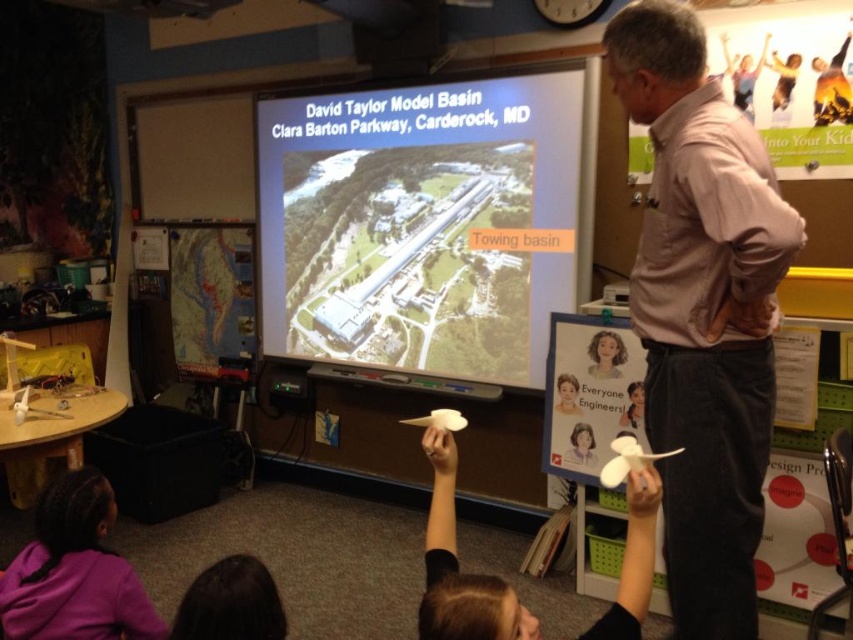
Question: Is white paper airplane at center wider than matte black projector at upper center?

Choices:
 (A) yes
 (B) no

Answer: (B)

Question: Estimate the real-world distances between objects in this image. Which object is closer to the matte black projector at upper center?

Choices:
 (A) white paper airplane at right
 (B) purple fabric at lower left

Answer: (B)

Question: Can you confirm if white paper airplane at right is positioned below matte black projector at upper center?

Choices:
 (A) no
 (B) yes

Answer: (B)

Question: Which object appears farthest from the camera in this image?

Choices:
 (A) matte black projector at upper center
 (B) white paper airplane at right
 (C) matte white projector screen at center

Answer: (A)

Question: Among these objects, which one is farthest from the camera?

Choices:
 (A) matte black projector at upper center
 (B) purple fabric at lower left
 (C) white paper airplane at center

Answer: (A)

Question: Can you confirm if matte white projector screen at center is smaller than matte black projector at upper center?

Choices:
 (A) no
 (B) yes

Answer: (A)